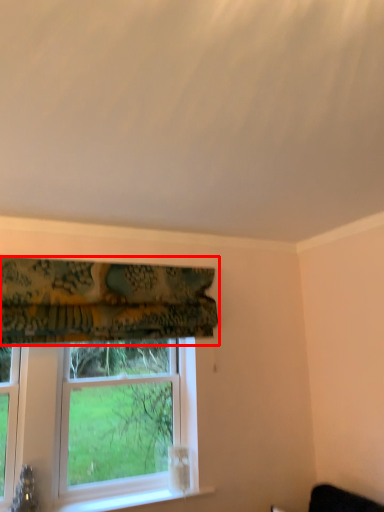
Question: In this image, where is curtain (annotated by the red box) located relative to window?

Choices:
 (A) right
 (B) left

Answer: (A)